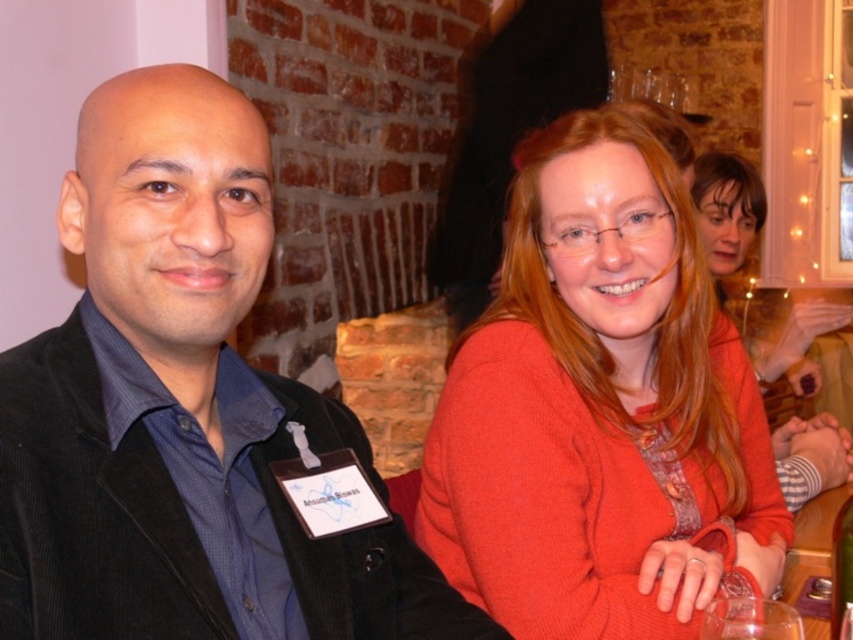
From the picture: You are organizing a small event and need to decide which item to place on a narrow shelf that can only accommodate items up to the width of the transparent plastic bottle at lower right. Based on the scene description, can the matte orange sweater at center fit on the shelf?

The matte orange sweater at center is wider than the transparent plastic bottle at lower right, so it cannot fit on the narrow shelf designed for items up to the bottle width.

You are a bartender at this event and need to place a drink on the table between the matte orange sweater at center and the transparent plastic bottle at lower right. The drink requires 25 centimeters of space. Is there enough space?

The distance between the matte orange sweater at center and the transparent plastic bottle at lower right is 37.52 centimeters, which is more than the required 25 centimeters. Yes, there is enough space to place the drink.